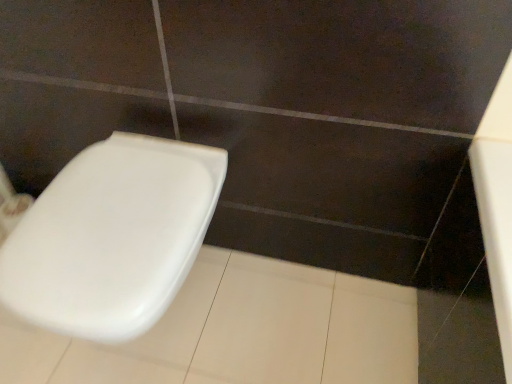
What are the coordinates of `white glossy toilet seat at left` in the screenshot? It's located at (112, 237).

Describe the element at coordinates (112, 237) in the screenshot. I see `white glossy toilet seat at left` at that location.

Locate an element on the screen. This screenshot has height=384, width=512. white glossy toilet seat at left is located at coordinates (112, 237).